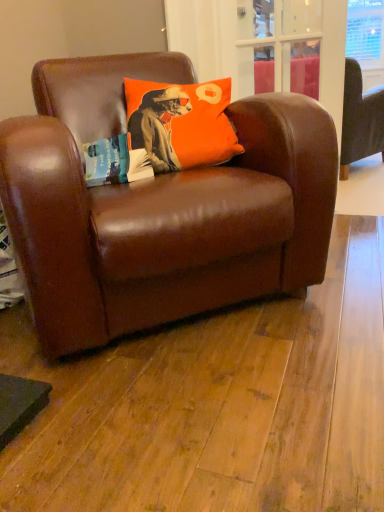
Question: Is point (61, 158) positioned closer to the camera than point (130, 145)?

Choices:
 (A) farther
 (B) closer

Answer: (B)

Question: Is brown leather chair at center inside the boundaries of orange matte pillow at upper center, or outside?

Choices:
 (A) inside
 (B) outside

Answer: (B)

Question: Based on their relative distances, which object is nearer to the orange matte pillow at upper center?

Choices:
 (A) brown leather couch at upper right
 (B) brown leather chair at center

Answer: (B)

Question: Which is farther from the brown leather couch at upper right?

Choices:
 (A) brown leather chair at center
 (B) orange matte pillow at upper center

Answer: (A)